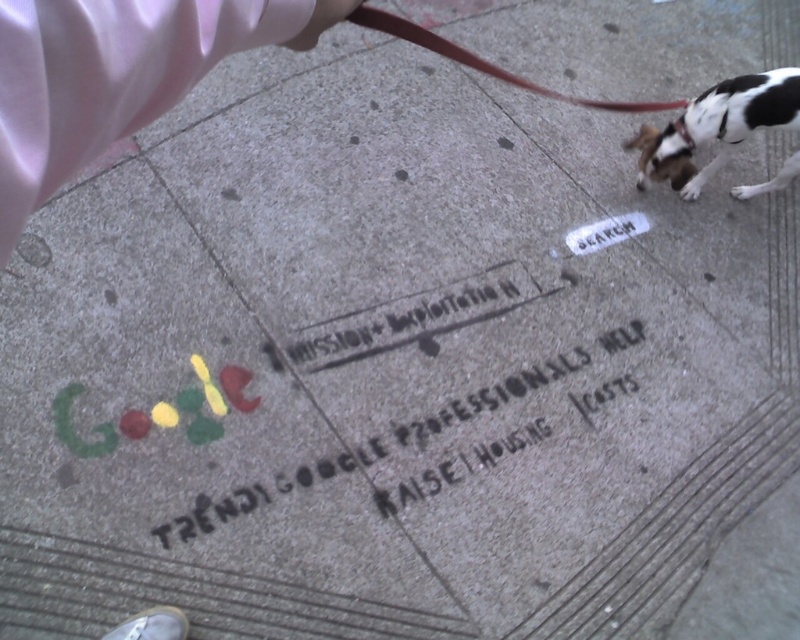
Who is more distant from viewer, (97, 84) or (724, 108)?

Positioned behind is point (724, 108).

Can you confirm if pink satin ribbon at upper left is positioned to the left of white and black fur dog at upper right?

Indeed, pink satin ribbon at upper left is positioned on the left side of white and black fur dog at upper right.

Looking at this image, who is more forward, (x=117, y=90) or (x=722, y=96)?

Point (x=117, y=90)

This screenshot has height=640, width=800. I want to click on pink satin ribbon at upper left, so click(x=114, y=76).

Consider the image. Is black stenciled text at center to the right of white and black fur dog at upper right from the viewer's perspective?

No, black stenciled text at center is not to the right of white and black fur dog at upper right.

Does black stenciled text at center have a greater height compared to white and black fur dog at upper right?

Yes, black stenciled text at center is taller than white and black fur dog at upper right.

The image size is (800, 640). What do you see at coordinates (397, 435) in the screenshot?
I see `black stenciled text at center` at bounding box center [397, 435].

Where is `black stenciled text at center`? The width and height of the screenshot is (800, 640). black stenciled text at center is located at coordinates (397, 435).

Is white and black fur dog at upper right wider than brown leather leash at upper center?

No, white and black fur dog at upper right is not wider than brown leather leash at upper center.

Can you confirm if white and black fur dog at upper right is positioned to the right of brown leather leash at upper center?

Correct, you'll find white and black fur dog at upper right to the right of brown leather leash at upper center.

Is point (745, 104) farther from viewer compared to point (605, 106)?

Yes, it is.

This screenshot has height=640, width=800. I want to click on white and black fur dog at upper right, so click(x=716, y=128).